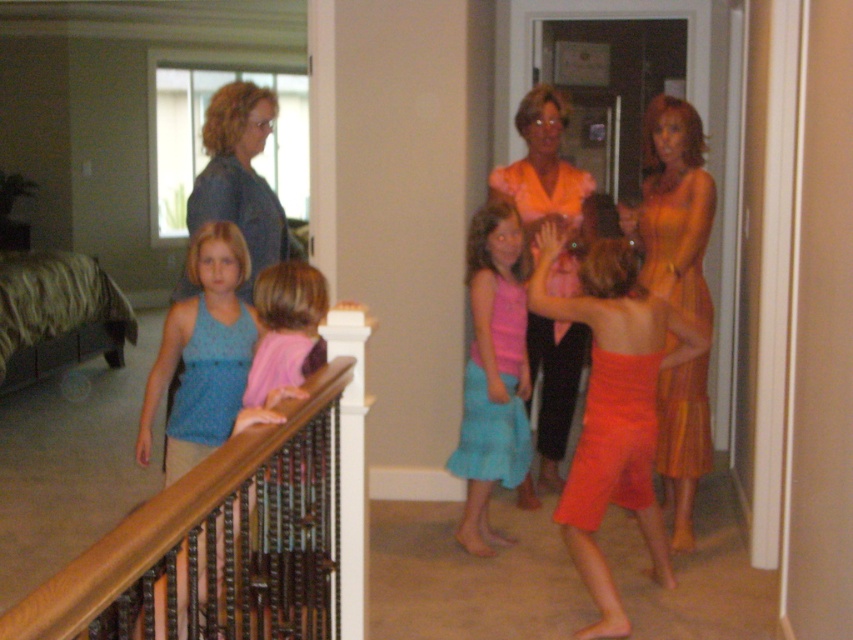
Question: Is orange satin blouse at center closer to camera compared to pink fabric shirt at upper left?

Choices:
 (A) no
 (B) yes

Answer: (A)

Question: Which point is closer to the camera?

Choices:
 (A) (666, 284)
 (B) (323, 340)

Answer: (B)

Question: Observing the image, what is the correct spatial positioning of orange satin dress at center in reference to denim jacket at left?

Choices:
 (A) left
 (B) right

Answer: (B)

Question: Which object is farther from the camera taking this photo?

Choices:
 (A) blue polka dot tank top at left
 (B) pink fabric shirt at upper left
 (C) orange satin dress at right
 (D) denim jacket at left

Answer: (C)

Question: Among these objects, which one is farthest from the camera?

Choices:
 (A) pink fabric shirt at upper left
 (B) wooden at upper left
 (C) orange satin blouse at center

Answer: (B)

Question: Observing the image, what is the correct spatial positioning of wooden at upper left in reference to matte blue dress at center?

Choices:
 (A) above
 (B) below

Answer: (B)